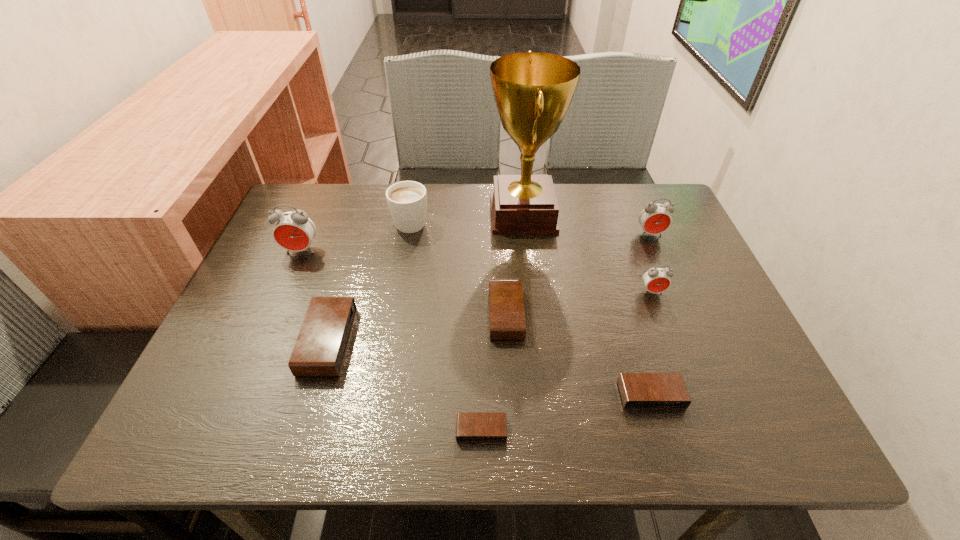
Identify the location of vacant space located 0.160m on the front face of the seventh tallest object. (419, 314).

Locate an element on the screen. The height and width of the screenshot is (540, 960). free region located 0.060m on the front face of the second nearest black alarm clock is located at coordinates (664, 440).

The height and width of the screenshot is (540, 960). Find the location of `award at the far edge`. award at the far edge is located at coordinates (533, 91).

The width and height of the screenshot is (960, 540). In order to click on alarm clock that is at the far edge in this screenshot , I will do tap(654, 218).

Locate an element on the screen. This screenshot has width=960, height=540. cappuccino that is at the far edge is located at coordinates (407, 200).

Locate an element on the screen. Image resolution: width=960 pixels, height=540 pixels. object at the left edge is located at coordinates (294, 231).

Where is `object present at the far right corner`? Image resolution: width=960 pixels, height=540 pixels. object present at the far right corner is located at coordinates (654, 218).

Locate an element on the screen. This screenshot has height=540, width=960. free space at the far edge is located at coordinates (433, 219).

Where is `free space at the near edge of the desktop`? The image size is (960, 540). free space at the near edge of the desktop is located at coordinates (600, 446).

The height and width of the screenshot is (540, 960). Find the location of `free space at the left edge`. free space at the left edge is located at coordinates (285, 360).